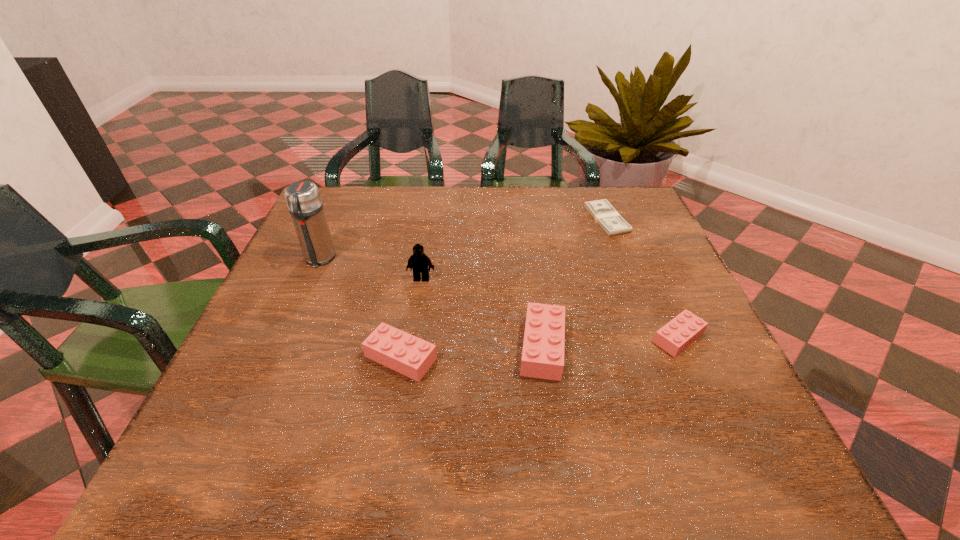
At what (x,y) coordinates should I click in order to perform the action: click on the third farthest object. Please return your answer as a coordinate pair (x, y). Looking at the image, I should click on (418, 262).

Find the location of a particular element. free region located on the back of the fourth tallest object is located at coordinates [413, 288].

Locate an element on the screen. This screenshot has width=960, height=540. free space located on the back of the fourth shortest object is located at coordinates (x=534, y=282).

At what (x,y) coordinates should I click in order to perform the action: click on free space located on the left of the rightmost Lego. Please return your answer as a coordinate pair (x, y). Looking at the image, I should click on (531, 338).

Locate an element on the screen. vacant space situated on the front of the shortest object is located at coordinates (646, 322).

Identify the location of vacant point located 0.110m with a handle on the side of the second farthest object. (300, 305).

Find the location of `vacant space situated 0.260m on the face of the fourth nearest object`. vacant space situated 0.260m on the face of the fourth nearest object is located at coordinates (407, 376).

At what (x,y) coordinates should I click in order to perform the action: click on object located at the far edge. Please return your answer as a coordinate pair (x, y). Looking at the image, I should click on (602, 211).

The height and width of the screenshot is (540, 960). Identify the location of object at the left edge. (303, 198).

Image resolution: width=960 pixels, height=540 pixels. I want to click on Lego situated at the right edge, so click(x=675, y=336).